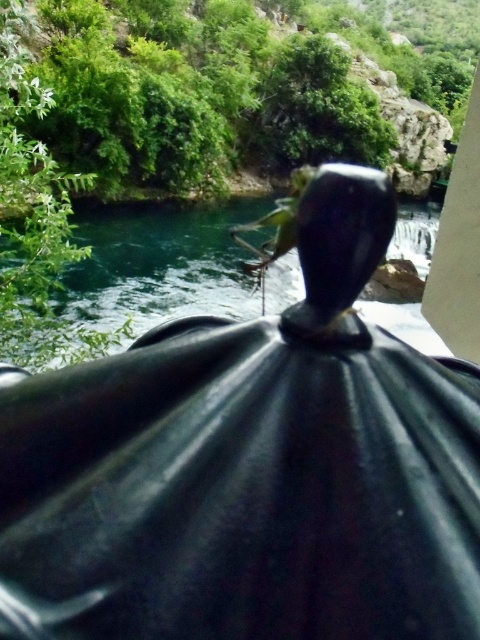
Describe the element at coordinates (250, 468) in the screenshot. I see `black glossy umbrella at center` at that location.

Between point (408, 419) and point (402, 236), which one is positioned in front?

Positioned in front is point (408, 419).

Between point (152, 330) and point (152, 232), which one is positioned in front?

Positioned in front is point (152, 330).

Find the location of a particular element. black glossy umbrella at center is located at coordinates (250, 468).